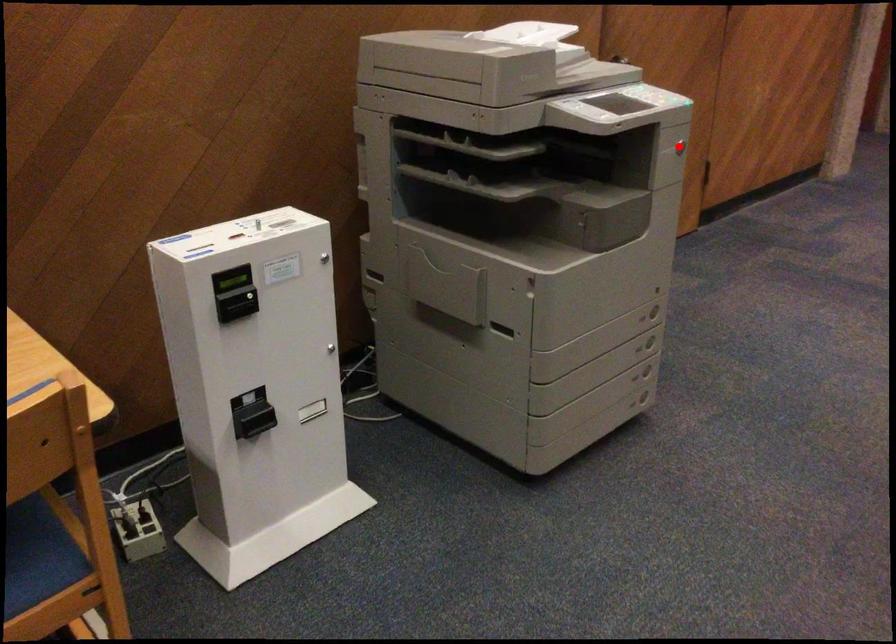
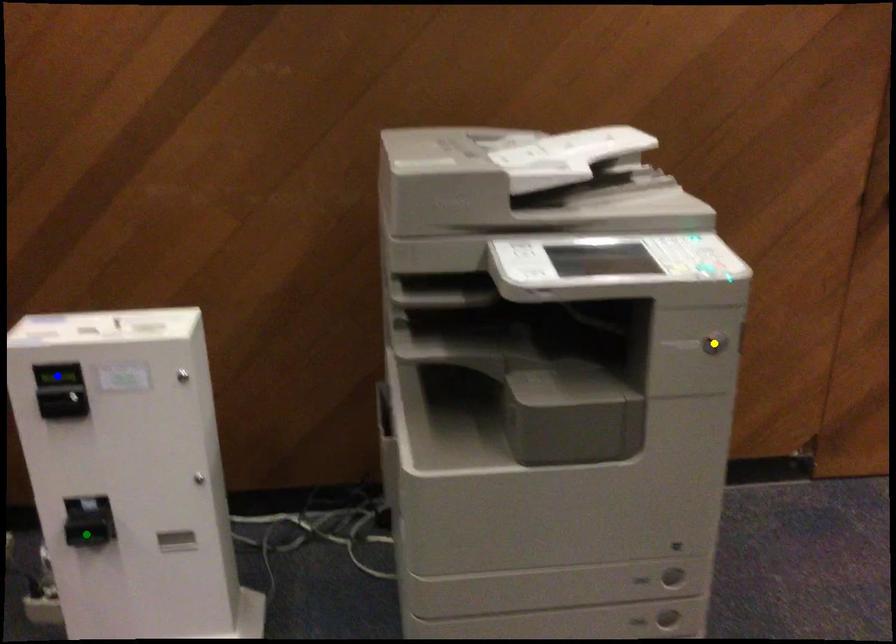
Question: I am providing you with two images of the same scene from different viewpoints. A red point is marked on the first image. You are given multiple points on the second image. Can you choose the point in image 2 that corresponds to the point in image 1?

Choices:
 (A) yellow point
 (B) green point
 (C) blue point

Answer: (A)